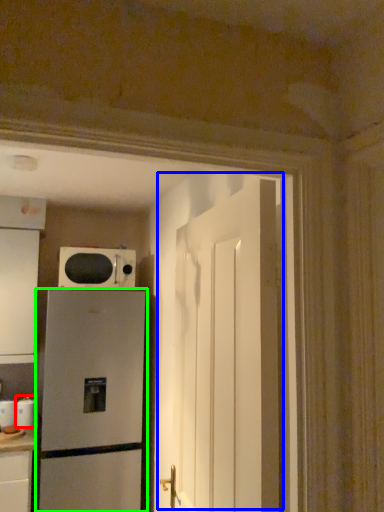
Question: Which object is positioned farthest from appliance (highlighted by a red box)? Select from door (highlighted by a blue box) and refrigerator (highlighted by a green box).

Choices:
 (A) door
 (B) refrigerator

Answer: (A)